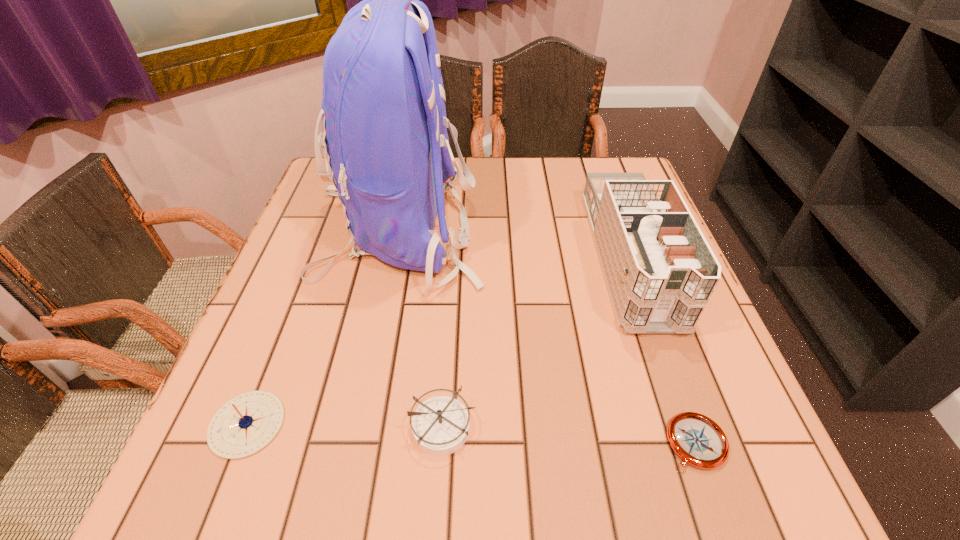
The image size is (960, 540). I want to click on the tallest object, so click(x=384, y=123).

Identify the location of dollhouse. The width and height of the screenshot is (960, 540). (660, 271).

Identify the location of the second compass from right to left. (440, 425).

The height and width of the screenshot is (540, 960). I want to click on the leftmost compass, so click(244, 425).

Where is `the shortest object`? the shortest object is located at coordinates pyautogui.click(x=699, y=441).

Locate an element on the screen. The image size is (960, 540). the shortest compass is located at coordinates (699, 441).

The height and width of the screenshot is (540, 960). In order to click on vacant space situated 0.090m on the back of the tallest object in this screenshot , I will do `click(520, 230)`.

Where is `vacant region located 0.170m at the entrance of the second tallest object`? vacant region located 0.170m at the entrance of the second tallest object is located at coordinates (686, 422).

This screenshot has height=540, width=960. What are the coordinates of `vacant space positioned 0.200m on the left of the second compass from left to right` in the screenshot? It's located at (287, 427).

Identify the location of free space located 0.050m on the back of the leftmost compass. (270, 368).